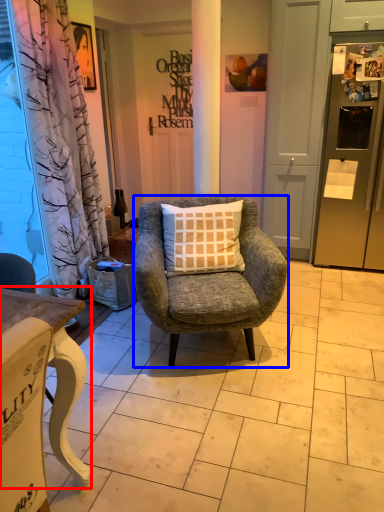
Question: Which object appears farthest to the camera in this image, desk (highlighted by a red box) or chair (highlighted by a blue box)?

Choices:
 (A) desk
 (B) chair

Answer: (B)